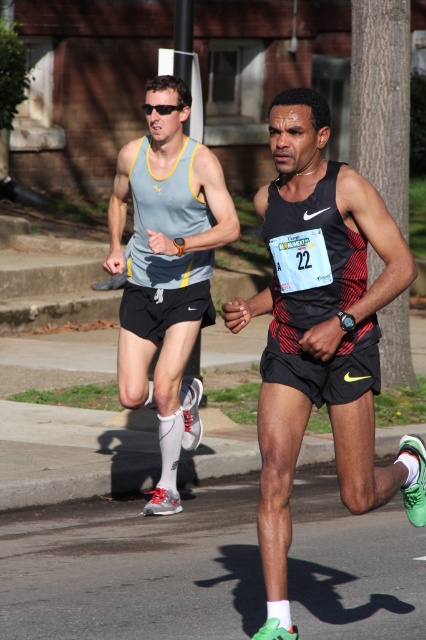
You are a photographer standing at the camera position. You want to take a photo of the runner wearing a black tank top with red and black stripes. The camera can only focus on objects within 5 meters. Is the point at coordinates point [340,269] within the focus range?

The distance between point [340,269] and the camera is 5.08 meters. Since the camera can only focus on objects within 5 meters, the point is just beyond the focus range. Therefore, the camera cannot focus on the runner at point [340,269].

You are a photographer at the marathon event. You want to capture a photo where the green matte running shoe at right and the matte gray tank top at left are both visible. Based on their positions, which object should appear lower in the photo?

The green matte running shoe at right is located below the matte gray tank top at left, so in the photo, the green matte running shoe at right will appear lower than the matte gray tank top at left.

You are a photographer standing at the starting line of the marathon. You want to take a photo that includes both the green matte running shoe at right and the matte gray tank top at left. Based on their positions, which object should you adjust your camera to focus on first to ensure both are in the frame?

The green matte running shoe at right is to the right of the matte gray tank top at left. To include both in the frame, focus on the matte gray tank top at left first since it is closer to your left side, then adjust the camera to include the green matte running shoe at right on the right side.